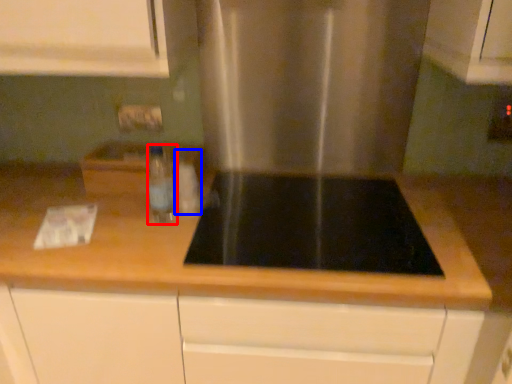
Question: Which object appears farthest to the camera in this image, bottle (highlighted by a red box) or bottle (highlighted by a blue box)?

Choices:
 (A) bottle
 (B) bottle

Answer: (B)